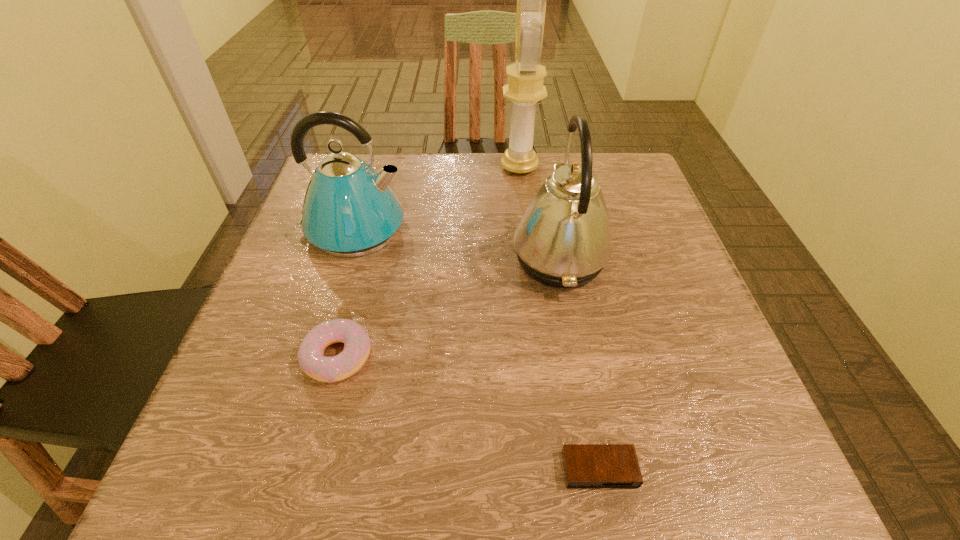
The width and height of the screenshot is (960, 540). I want to click on vacant area situated on the front-facing side of the farthest object, so point(481,167).

Locate an element on the screen. Image resolution: width=960 pixels, height=540 pixels. vacant position located 0.300m from the spout of the right kettle is located at coordinates (368, 259).

Where is `free space located 0.260m from the spout of the right kettle`? The width and height of the screenshot is (960, 540). free space located 0.260m from the spout of the right kettle is located at coordinates (387, 259).

You are a GUI agent. You are given a task and a screenshot of the screen. Output one action in this format:
    pyautogui.click(x=<x>, y=<y>)
    Task: Click on the free location located 0.280m from the spout of the right kettle
    
    Given the screenshot: What is the action you would take?
    pyautogui.click(x=377, y=259)

Identify the location of free region located at the spout of the left kettle. (506, 229).

Find the location of a particular element. The width and height of the screenshot is (960, 540). free region located 0.250m on the back of the fourth tallest object is located at coordinates pyautogui.click(x=370, y=237).

The image size is (960, 540). Find the location of `award that is at the far edge`. award that is at the far edge is located at coordinates (525, 88).

Locate an element on the screen. The height and width of the screenshot is (540, 960). kettle that is positioned at the far edge is located at coordinates (349, 210).

You are a GUI agent. You are given a task and a screenshot of the screen. Output one action in this format:
    pyautogui.click(x=<x>, y=<y>)
    Task: Click on the object positioned at the near edge
    This screenshot has height=540, width=960.
    Given the screenshot: What is the action you would take?
    pyautogui.click(x=585, y=465)

I want to click on kettle that is at the left edge, so click(349, 210).